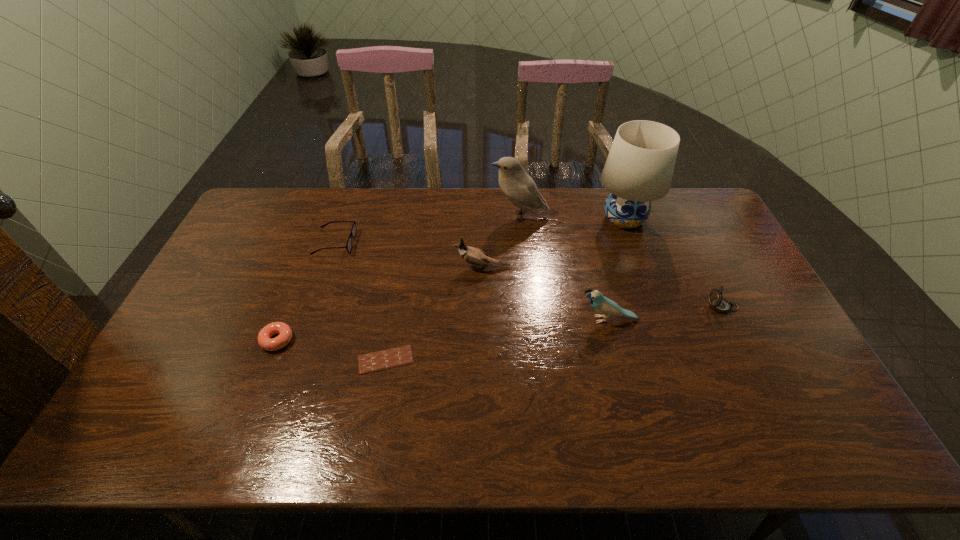
Where is `lampshade`? This screenshot has height=540, width=960. lampshade is located at coordinates (639, 168).

You are a GUI agent. You are given a task and a screenshot of the screen. Output one action in this format:
    pyautogui.click(x=<x>, y=<y>)
    Task: Click on the farthest bird
    
    Given the screenshot: What is the action you would take?
    pyautogui.click(x=521, y=190)

Image resolution: width=960 pixels, height=540 pixels. Identify the location of the seventh shortest object. (521, 190).

Where is `the fourth farthest object`? the fourth farthest object is located at coordinates (474, 256).

Locate an element on the screen. The height and width of the screenshot is (540, 960). the rightmost bird is located at coordinates tap(601, 304).

You are a GUI agent. You are given a task and a screenshot of the screen. Output one action in this format:
    pyautogui.click(x=<x>, y=<y>)
    Task: Click on the fourth shortest object
    This screenshot has width=960, height=540.
    Given the screenshot: What is the action you would take?
    pyautogui.click(x=719, y=304)

Locate an element on the screen. the rightmost object is located at coordinates (719, 304).

Identify the location of spectacles. The width and height of the screenshot is (960, 540). (353, 231).

This screenshot has width=960, height=540. In order to click on doughnut in this screenshot , I will do `click(285, 333)`.

Locate an element on the screen. The height and width of the screenshot is (540, 960). the third object from left to right is located at coordinates (381, 360).